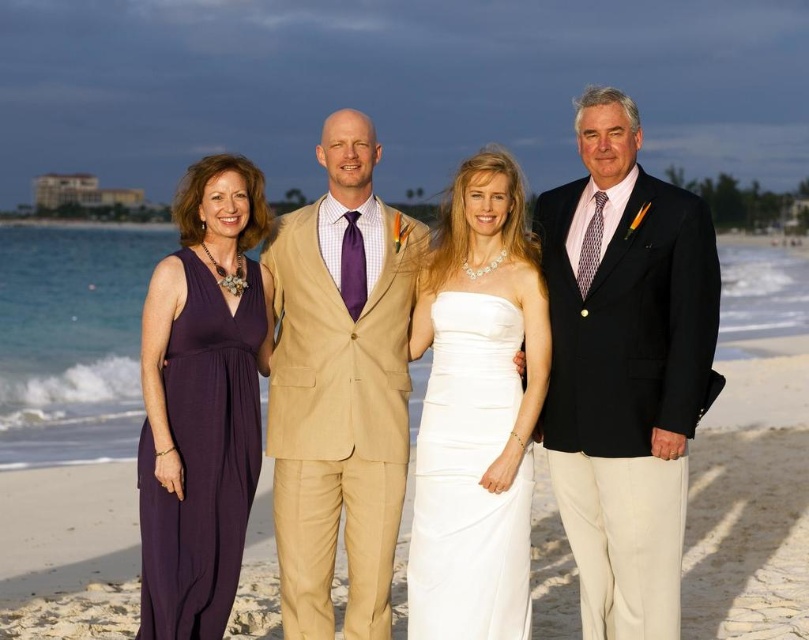
The width and height of the screenshot is (809, 640). I want to click on matte black suit at right, so click(625, 369).

Between matte black suit at right and purple silk dress at left, which one has less height?

Standing shorter between the two is matte black suit at right.

What do you see at coordinates (625, 369) in the screenshot?
I see `matte black suit at right` at bounding box center [625, 369].

Locate an element on the screen. matte black suit at right is located at coordinates (625, 369).

Consider the image. Is beige textured suit at center above purple silk dress at left?

Correct, beige textured suit at center is located above purple silk dress at left.

The height and width of the screenshot is (640, 809). What are the coordinates of `beige textured suit at center` in the screenshot? It's located at (341, 387).

Who is more forward, (388, 618) or (227, 442)?

Positioned in front is point (227, 442).

You are a GUI agent. You are given a task and a screenshot of the screen. Output one action in this format:
    pyautogui.click(x=<x>, y=<y>)
    Task: Click on the beige textured suit at center
    The width and height of the screenshot is (809, 640).
    Given the screenshot: What is the action you would take?
    pyautogui.click(x=341, y=387)

Is white satin dress at center to the right of purple silk dress at left from the viewer's perspective?

Yes, white satin dress at center is to the right of purple silk dress at left.

Is white satin dress at center bigger than purple silk dress at left?

No.

Find the location of a particular element. This screenshot has height=640, width=809. white satin dress at center is located at coordinates (477, 412).